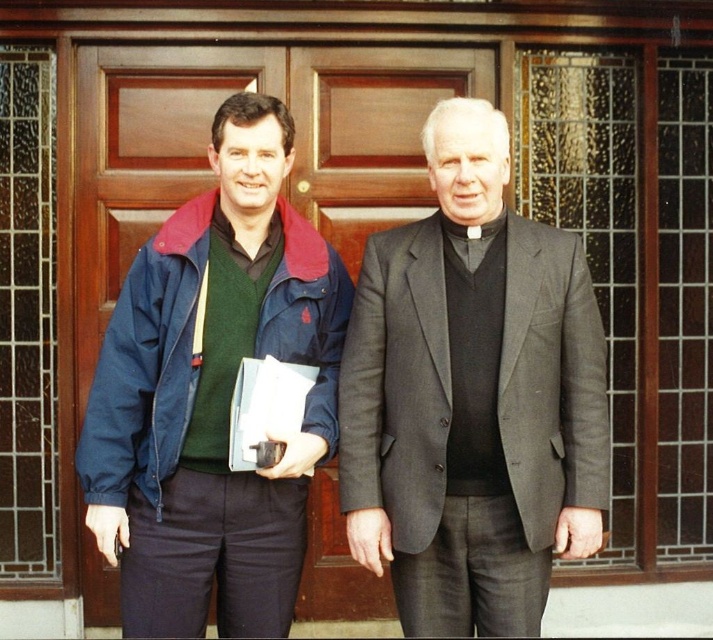
You are a photographer who needs to take a photo of the dark gray suit at center. The camera you are holding is 10.51 feet away from the suit. Is the distance sufficient to capture the entire suit in the frame?

The camera and the dark gray suit at center are 10.51 feet apart. At this distance, the photographer can likely capture the entire dark gray suit at center in the frame, assuming the camera has a wide enough lens or the photographer adjusts their position accordingly.

You are a security guard who needs to verify the location of the dark gray suit at center and the brown wooden door at left. Based on the scene, which object is located to the right of the other?

The dark gray suit at center is positioned on the right side of brown wooden door at left.